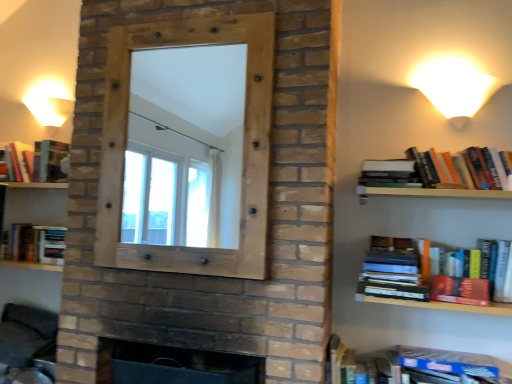
This screenshot has width=512, height=384. What do you see at coordinates (396, 269) in the screenshot?
I see `hardcover book at right` at bounding box center [396, 269].

Find the location of a particular element. This screenshot has width=512, height=384. hardcover book at right is located at coordinates [x=396, y=269].

The width and height of the screenshot is (512, 384). What are the coordinates of `hardcover book at upper right, the 3th book ordered from the bottom` in the screenshot? It's located at (389, 173).

Where is `wooden frame at center`? The height and width of the screenshot is (384, 512). wooden frame at center is located at coordinates (243, 146).

This screenshot has height=384, width=512. Find the location of `matte white lampshade at upper left, the 2th table lamp from the front`. matte white lampshade at upper left, the 2th table lamp from the front is located at coordinates (49, 105).

The image size is (512, 384). Find the location of `blue hardcover book at lower right, the first book from the bottom`. blue hardcover book at lower right, the first book from the bottom is located at coordinates (411, 366).

Is hardcover book at left, which is counted as the first book, starting from the left, facing towards hardcover book at lower left, which is counted as the 2th book, starting from the left?

No, hardcover book at left, which is counted as the first book, starting from the left, is not turned towards hardcover book at lower left, which is counted as the 2th book, starting from the left.

Relative to hardcover book at lower left, the second book in the bottom-to-top sequence, is hardcover book at left, the fifth book when ordered from bottom to top, in front or behind?

Visually, hardcover book at left, the fifth book when ordered from bottom to top, is located behind hardcover book at lower left, the second book in the bottom-to-top sequence.

Do you think hardcover book at left, which is counted as the first book, starting from the left, is within hardcover book at lower left, the second book in the bottom-to-top sequence, or outside of it?

hardcover book at left, which is counted as the first book, starting from the left, lies outside hardcover book at lower left, the second book in the bottom-to-top sequence.

Between point (3, 146) and point (41, 259), which one is positioned behind?

Positioned behind is point (3, 146).

From the image's perspective, is hardcover book at upper right, positioned as the 3th book in top-to-bottom order, located above white glossy table lamp at upper right, which is the 1th table lamp from front to back?

No.

Between hardcover book at upper right, the 3th book ordered from the bottom, and white glossy table lamp at upper right, which is the 1th table lamp from front to back, which one appears on the left side from the viewer's perspective?

hardcover book at upper right, the 3th book ordered from the bottom, is more to the left.

Is hardcover book at upper right, positioned as the 3th book in top-to-bottom order, inside or outside of white glossy table lamp at upper right, which is the 2th table lamp in left-to-right order?

The correct answer is: outside.

Could you tell me if hardcover book at upper right, positioned as the 3th book in left-to-right order, is facing white glossy table lamp at upper right, which is the 2th table lamp in left-to-right order?

No, hardcover book at upper right, positioned as the 3th book in left-to-right order, is not oriented towards white glossy table lamp at upper right, which is the 2th table lamp in left-to-right order.

Could you tell me if white glossy table lamp at upper right, which ranks as the second table lamp in back-to-front order, is turned towards matte white lampshade at upper left, the 2th table lamp viewed from the right?

No.

Can you tell me how much white glossy table lamp at upper right, which ranks as the second table lamp in back-to-front order, and matte white lampshade at upper left, the 2th table lamp viewed from the right, differ in facing direction?

0.000362 degrees.

Is white glossy table lamp at upper right, which ranks as the second table lamp in back-to-front order, further to the viewer compared to matte white lampshade at upper left, the 1th table lamp viewed from the left?

No, it is not.

How much distance is there between dark brick fireplace at center and matte white lampshade at upper left, the 2th table lamp viewed from the right?

The distance of dark brick fireplace at center from matte white lampshade at upper left, the 2th table lamp viewed from the right, is 1.50 meters.

Is dark brick fireplace at center beside matte white lampshade at upper left, the 2th table lamp from the front?

dark brick fireplace at center and matte white lampshade at upper left, the 2th table lamp from the front, are not in contact.

From a real-world perspective, does dark brick fireplace at center stand above matte white lampshade at upper left, arranged as the first table lamp when viewed from the back?

No, from a real-world perspective, dark brick fireplace at center is not on top of matte white lampshade at upper left, arranged as the first table lamp when viewed from the back.

Looking at their sizes, would you say dark brick fireplace at center is wider or thinner than matte white lampshade at upper left, arranged as the first table lamp when viewed from the back?

dark brick fireplace at center is wider than matte white lampshade at upper left, arranged as the first table lamp when viewed from the back.

Which object is further away from the camera taking this photo, hardcover book at lower left, the 4th book positioned from the top, or hardcover book at right?

hardcover book at lower left, the 4th book positioned from the top, is more distant.

Is hardcover book at lower left, arranged as the fourth book when viewed from the right, situated inside hardcover book at right or outside?

hardcover book at lower left, arranged as the fourth book when viewed from the right, lies outside hardcover book at right.

From a real-world perspective, is hardcover books at upper right, the fifth book viewed from the left, positioned above or below matte white lampshade at upper left, the 1th table lamp viewed from the left?

From a real-world perspective, hardcover books at upper right, the fifth book viewed from the left, is physically below matte white lampshade at upper left, the 1th table lamp viewed from the left.

Is hardcover books at upper right, the fourth book when ordered from bottom to top, facing towards matte white lampshade at upper left, the 2th table lamp from the front?

No, hardcover books at upper right, the fourth book when ordered from bottom to top, is not oriented towards matte white lampshade at upper left, the 2th table lamp from the front.

Is hardcover books at upper right, the fifth book viewed from the left, far from matte white lampshade at upper left, the 2th table lamp from the front?

Indeed, hardcover books at upper right, the fifth book viewed from the left, is not near matte white lampshade at upper left, the 2th table lamp from the front.

From a real-world perspective, starting from the hardcover book at right, which table lamp is the 2nd one vertically above it? Please provide its 2D coordinates.

[(49, 105)]

Is point (417, 256) closer to camera compared to point (49, 108)?

That is True.

From the picture: Does hardcover book at right appear on the right side of matte white lampshade at upper left, the 2th table lamp from the front?

Yes.

From the image's perspective, would you say hardcover book at right is shown under matte white lampshade at upper left, the 1th table lamp viewed from the left?

Yes, from the image's perspective, hardcover book at right is beneath matte white lampshade at upper left, the 1th table lamp viewed from the left.

The height and width of the screenshot is (384, 512). Find the location of `book behind the hardcover book at lower left, the 4th book positioned from the top`. book behind the hardcover book at lower left, the 4th book positioned from the top is located at coordinates (35, 160).

The image size is (512, 384). What are the coordinates of `table lamp on the right of hardcover book at upper right, the 3th book ordered from the bottom` in the screenshot? It's located at (454, 87).

In the scene shown: Looking at the image, which one is located further to dark gray fabric swivel chair at lower left, hardcover book at lower left, arranged as the fourth book when viewed from the right, or hardcover book at upper right, the 3th book ordered from the bottom?

Based on the image, hardcover book at upper right, the 3th book ordered from the bottom, appears to be further to dark gray fabric swivel chair at lower left.

When comparing their distances from matte white lampshade at upper left, the 1th table lamp viewed from the left, does blue hardcover book at lower right, the fourth book when ordered from left to right, or hardcover book at right seem further?

blue hardcover book at lower right, the fourth book when ordered from left to right, lies further to matte white lampshade at upper left, the 1th table lamp viewed from the left, than the other object.

Estimate the real-world distances between objects in this image. Which object is closer to hardcover book at left, which is counted as the first book, starting from the left, blue hardcover book at lower right, which is the 5th book from top to bottom, or hardcover book at upper right, positioned as the 3th book in top-to-bottom order?

hardcover book at upper right, positioned as the 3th book in top-to-bottom order, lies closer to hardcover book at left, which is counted as the first book, starting from the left, than the other object.

Looking at this image, which object lies further to the anchor point hardcover book at left, the fifth book when ordered from bottom to top, dark gray fabric swivel chair at lower left or hardcover book at upper right, the 3th book ordered from the bottom?

hardcover book at upper right, the 3th book ordered from the bottom, is further to hardcover book at left, the fifth book when ordered from bottom to top.

Which object lies further to the anchor point matte white lampshade at upper left, the 2th table lamp viewed from the right, hardcover book at lower left, the 4th book positioned from the top, or hardcover book at upper right, positioned as the 3th book in left-to-right order?

The object further to matte white lampshade at upper left, the 2th table lamp viewed from the right, is hardcover book at upper right, positioned as the 3th book in left-to-right order.

Considering their positions, is dark brick fireplace at center positioned further to blue hardcover book at lower right, which is the 5th book from top to bottom, than dark gray fabric swivel chair at lower left?

dark gray fabric swivel chair at lower left is further to blue hardcover book at lower right, which is the 5th book from top to bottom.

From the image, which object appears to be farther from dark brick fireplace at center, white glossy table lamp at upper right, the 1th table lamp when ordered from right to left, or wooden frame at center?

Among the two, white glossy table lamp at upper right, the 1th table lamp when ordered from right to left, is located further to dark brick fireplace at center.

Estimate the real-world distances between objects in this image. Which object is further from blue hardcover book at lower right, the 2th book in the right-to-left sequence, hardcover book at left, arranged as the first book when viewed from the top, or dark brick fireplace at center?

hardcover book at left, arranged as the first book when viewed from the top, lies further to blue hardcover book at lower right, the 2th book in the right-to-left sequence, than the other object.

Image resolution: width=512 pixels, height=384 pixels. Identify the location of window frame between hardcover book at lower left, the 4th book positioned from the top, and white glossy table lamp at upper right, the 1th table lamp when ordered from right to left, from left to right. (243, 146).

Where is `paperback book located between matte white lampshade at upper left, the 1th table lamp viewed from the left, and blue hardcover book at lower right, the fourth book when ordered from left to right, in the left-right direction`? paperback book located between matte white lampshade at upper left, the 1th table lamp viewed from the left, and blue hardcover book at lower right, the fourth book when ordered from left to right, in the left-right direction is located at coordinates (396, 269).

Locate an element on the screen. This screenshot has width=512, height=384. fireplace located between hardcover book at lower left, the second book in the bottom-to-top sequence, and hardcover books at upper right, placed as the first book when sorted from right to left, in the left-right direction is located at coordinates (173, 365).

Locate an element on the screen. This screenshot has height=384, width=512. paperback book located between wooden frame at center and hardcover books at upper right, placed as the first book when sorted from right to left, in the left-right direction is located at coordinates (396, 269).